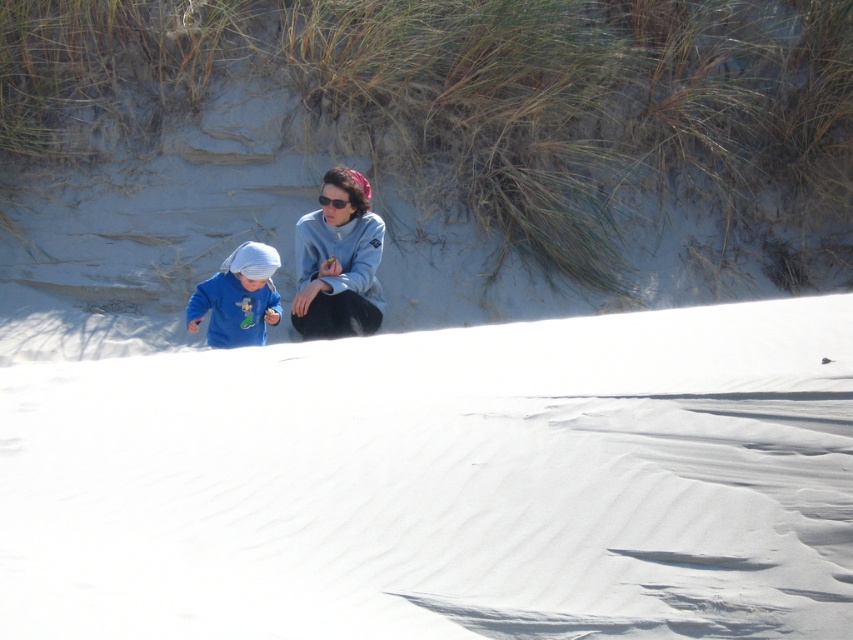
You are planning to build a snowman using the white powdery snow at center and the smooth sand dune at center. Which material would be more suitable for building a snowman and why?

The white powdery snow at center is more suitable for building a snowman because it is larger in width than the smooth sand dune at center, providing more material to work with.

You are standing at the point marked by the coordinates point (442,483) in the image. What material are you standing on?

The coordinates point (442,483) marks white powdery snow at center, so you are standing on white powdery snow at center.

You are standing in the scene and want to take a photo of the white powdery snow at center and the smooth sand dune at center. Which object should you focus on first if you want both to be in sharp focus?

You should focus on the smooth sand dune at center first because it is farther away from the viewer than the white powdery snow at center, ensuring both are in focus when using depth of field properly.